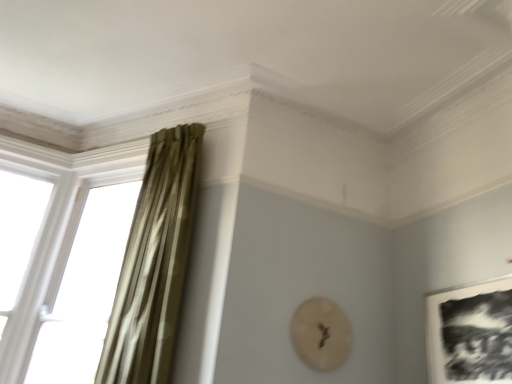
Question: Considering their positions, is green velvet curtain at left located in front of or behind black matte picture frame at lower right?

Choices:
 (A) front
 (B) behind

Answer: (B)

Question: Based on their positions, is green velvet curtain at left located to the left or right of black matte picture frame at lower right?

Choices:
 (A) right
 (B) left

Answer: (B)

Question: Based on their relative distances, which object is nearer to the green velvet curtain at left?

Choices:
 (A) black matte picture frame at lower right
 (B) translucent glass window at left

Answer: (B)

Question: Which object is the farthest from the translucent glass window at left?

Choices:
 (A) black matte picture frame at lower right
 (B) green velvet curtain at left

Answer: (A)